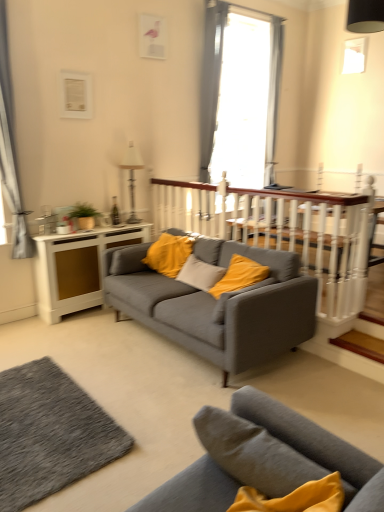
The image size is (384, 512). What are the coordinates of `vacant area that lies to the right of textured gray rug at lower left` in the screenshot? It's located at (151, 410).